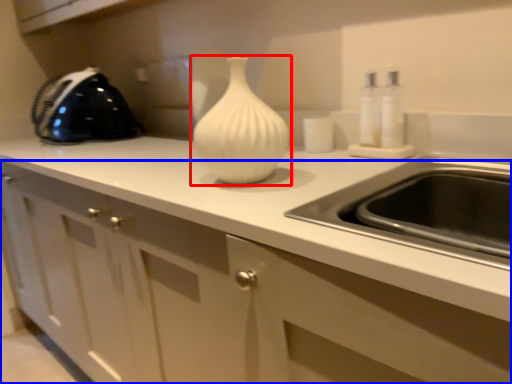
Question: Which point is further to the camera, vase (highlighted by a red box) or cabinetry (highlighted by a blue box)?

Choices:
 (A) vase
 (B) cabinetry

Answer: (A)